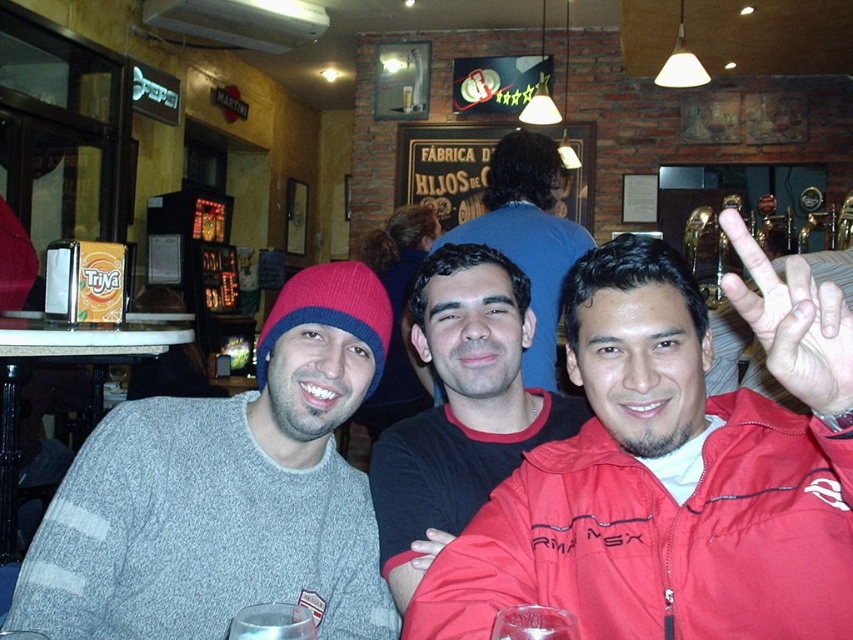
You are standing at the entrance of the bar and want to find the person wearing the black matte shirt at center. According to the coordinates provided, in which direction should you look relative to your position?

The black matte shirt at center is located at point 0.634 on the x and 0.542 on the y. Since the coordinates are relative to the image frame, you should look towards the center of the image where the person is seated.

You are a photographer trying to capture a closeup of the two shirts at the center. Since the black matte shirt at center and smooth black shirt at center are both in the frame, which one would you need to adjust your camera angle to focus on first if you want to capture both shirts fully in the photo?

The black matte shirt at center occupies less space than the smooth black shirt at center, so you should focus on the larger smooth black shirt at center first to ensure it fits within the frame before adjusting for the smaller one.